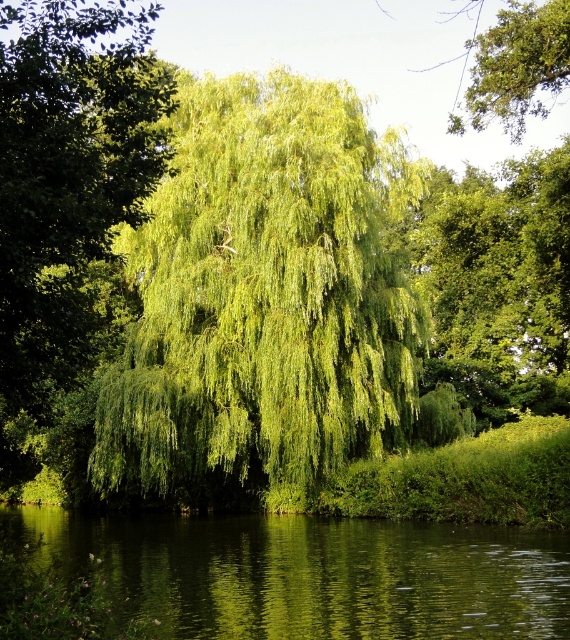
Question: Can you confirm if green leafy willow at center is positioned to the left of green reflective water at center?

Choices:
 (A) no
 (B) yes

Answer: (A)

Question: Is green leafy willow at center further to camera compared to green reflective water at center?

Choices:
 (A) yes
 (B) no

Answer: (A)

Question: Among these points, which one is farthest from the camera?

Choices:
 (A) (462, 620)
 (B) (300, 257)

Answer: (B)

Question: Which object appears farthest from the camera in this image?

Choices:
 (A) green leafy willow at center
 (B) green reflective water at center

Answer: (A)

Question: Considering the relative positions of green leafy willow at center and green reflective water at center in the image provided, where is green leafy willow at center located with respect to green reflective water at center?

Choices:
 (A) above
 (B) below

Answer: (A)